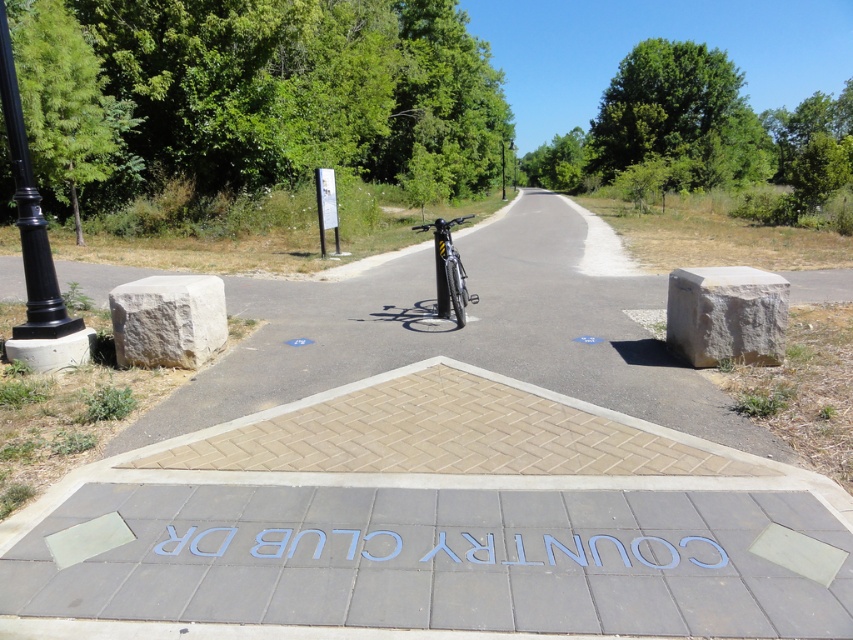
Can you confirm if shiny silver bicycle at center is taller than black metal lamp post at upper center?

In fact, shiny silver bicycle at center may be shorter than black metal lamp post at upper center.

Find the location of `shiny silver bicycle at center`. shiny silver bicycle at center is located at coordinates (450, 269).

Between black polished metal pole at left and shiny silver bicycle at center, which one has less height?

black polished metal pole at left

Which is in front, point (44, 316) or point (448, 272)?

Positioned in front is point (44, 316).

Find the location of a particular element. This screenshot has width=853, height=640. black polished metal pole at left is located at coordinates (28, 216).

Does black polished metal pole at left appear on the right side of black metal lamp post at upper center?

No, black polished metal pole at left is not to the right of black metal lamp post at upper center.

Between black polished metal pole at left and black metal lamp post at upper center, which one is positioned lower?

Positioned lower is black polished metal pole at left.

Which is in front, point (35, 285) or point (502, 144)?

Point (35, 285) is more forward.

Identify the location of black polished metal pole at left. click(28, 216).